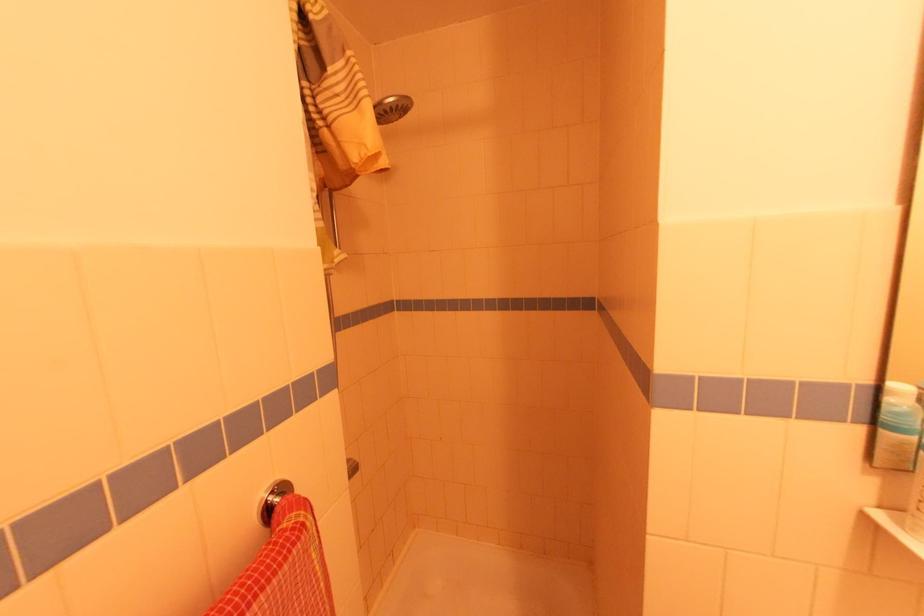
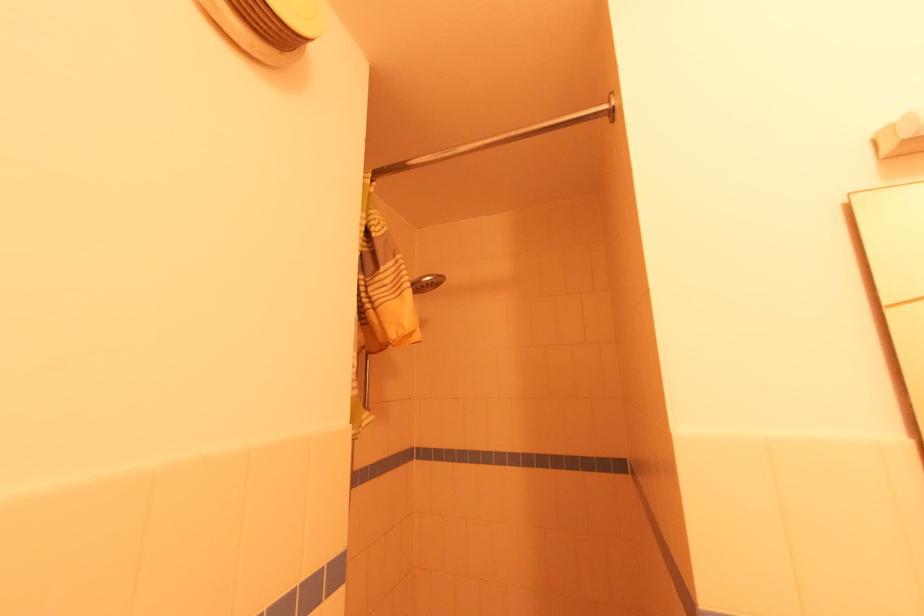
Question: How did the camera likely rotate?

Choices:
 (A) Left
 (B) Right
 (C) Up
 (D) Down

Answer: (C)